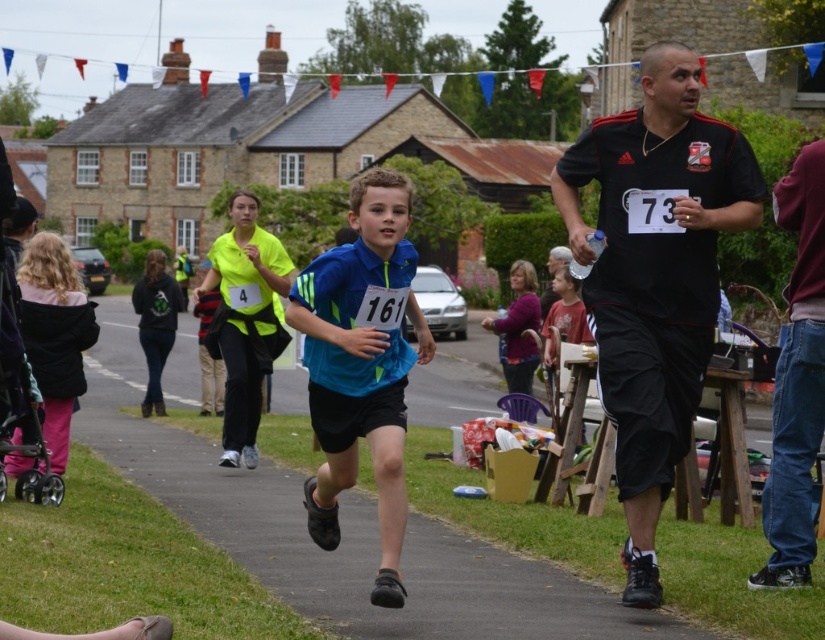
You are a photographer at the community event. You want to take a photo of the black matte shirt at right and the dark blue jeans at right. Which object should you focus on first if you want to capture both in one frame without moving the camera?

You should focus on the dark blue jeans at right first because it is taller than the black matte shirt at right, ensuring both can fit within the frame.